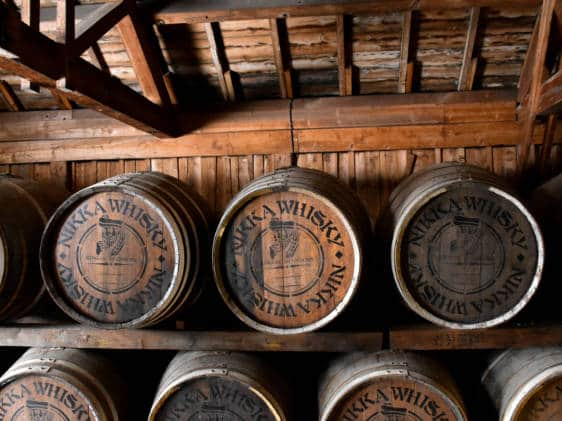
You are a GUI agent. You are given a task and a screenshot of the screen. Output one action in this format:
    pyautogui.click(x=<x>, y=<y>)
    Task: Click on the ceiling
    This screenshot has height=421, width=562.
    Given the screenshot: What is the action you would take?
    coord(255,51)